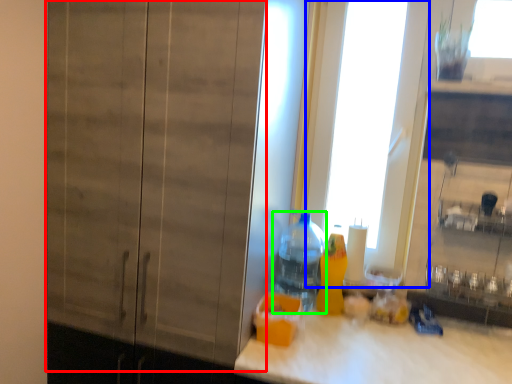
Question: Estimate the real-world distances between objects in this image. Which object is farther from barn door (highlighted by a red box), glass door (highlighted by a blue box) or bottle (highlighted by a green box)?

Choices:
 (A) glass door
 (B) bottle

Answer: (A)